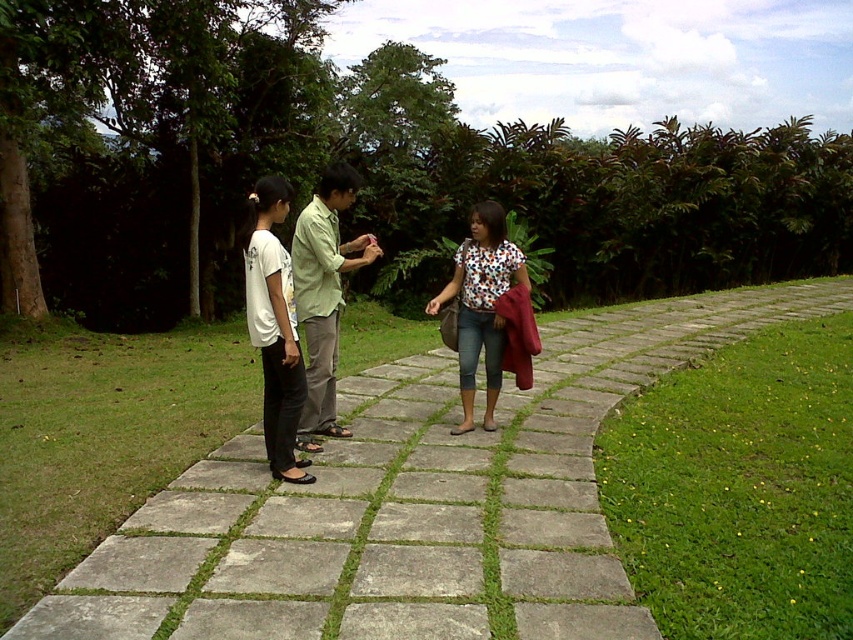
You are a photographer trying to capture a group photo of the matte green shirt at center and the green matte shirt at center. Since you want to ensure both subjects are in the frame, which direction should you position yourself relative to the subjects?

You should position yourself to the right of the matte green shirt at center and the green matte shirt at center, as the matte green shirt at center is to the left of the green matte shirt at center, meaning the green matte shirt at center is on the right side.

You are a photographer planning to take a group photo of the matte green shirt at center and the floral shirt at center. Which person should stand behind the other to ensure both are fully visible in the photo?

The matte green shirt at center is taller than the floral shirt at center, so the floral shirt at center should stand behind the matte green shirt at center to ensure both are fully visible in the photo.

You are a photographer trying to capture a group photo of the matte green shirt at center and the floral shirt at center. If you want to ensure both subjects are fully visible in the frame, which subject should you position closer to the camera to avoid cropping?

The matte green shirt at center has a larger width than the floral shirt at center, so positioning the matte green shirt at center closer to the camera will help ensure it fits within the frame without cropping.